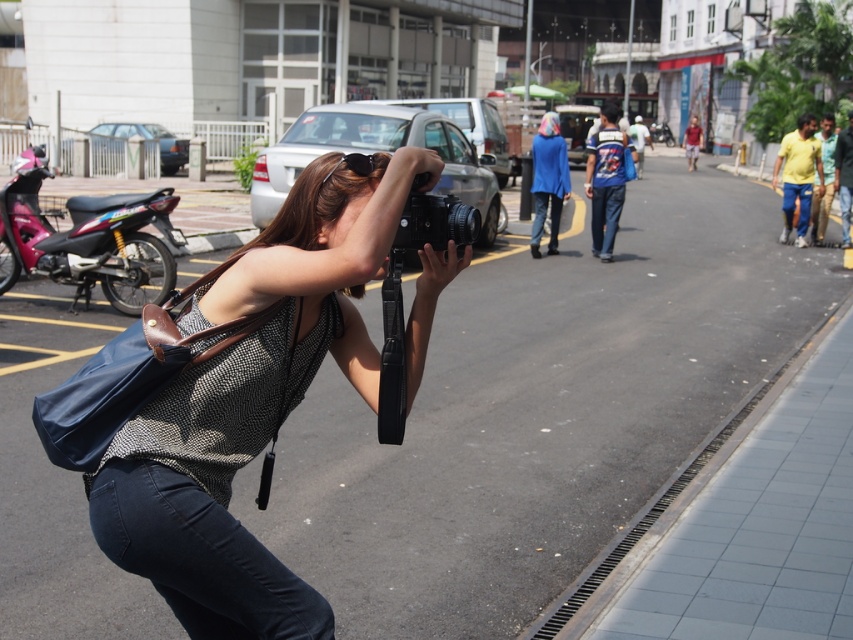
Does matte black camera at center appear under metallic pink motorcycle at left?

Yes, matte black camera at center is below metallic pink motorcycle at left.

Based on the photo, does matte black camera at center have a smaller size compared to metallic pink motorcycle at left?

Yes.

The image size is (853, 640). Find the location of `matte black camera at center`. matte black camera at center is located at coordinates (251, 401).

The width and height of the screenshot is (853, 640). What do you see at coordinates (86, 240) in the screenshot? I see `metallic pink motorcycle at left` at bounding box center [86, 240].

Between metallic pink motorcycle at left and black matte camera at center, which one has more height?

Standing taller between the two is metallic pink motorcycle at left.

Is point (44, 230) closer to viewer compared to point (427, 212)?

No, it is behind (427, 212).

Image resolution: width=853 pixels, height=640 pixels. Identify the location of metallic pink motorcycle at left. (86, 240).

Does matte black camera at center appear on the left side of black matte camera at center?

Correct, you'll find matte black camera at center to the left of black matte camera at center.

In the scene shown: Can you confirm if matte black camera at center is taller than black matte camera at center?

Indeed, matte black camera at center has a greater height compared to black matte camera at center.

The height and width of the screenshot is (640, 853). What do you see at coordinates (251, 401) in the screenshot?
I see `matte black camera at center` at bounding box center [251, 401].

The height and width of the screenshot is (640, 853). What are the coordinates of `matte black camera at center` in the screenshot? It's located at (251, 401).